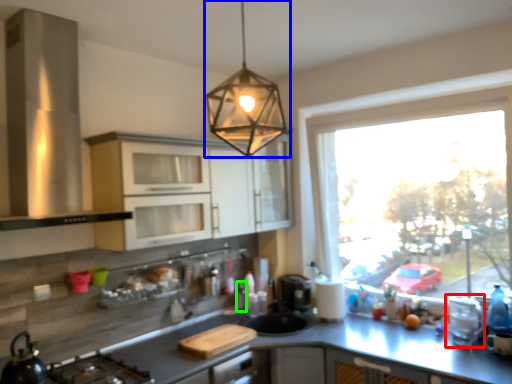
Question: Considering the real-world distances, which object is closest to appliance (highlighted by a red box)? lamp (highlighted by a blue box) or bottle (highlighted by a green box).

Choices:
 (A) lamp
 (B) bottle

Answer: (B)